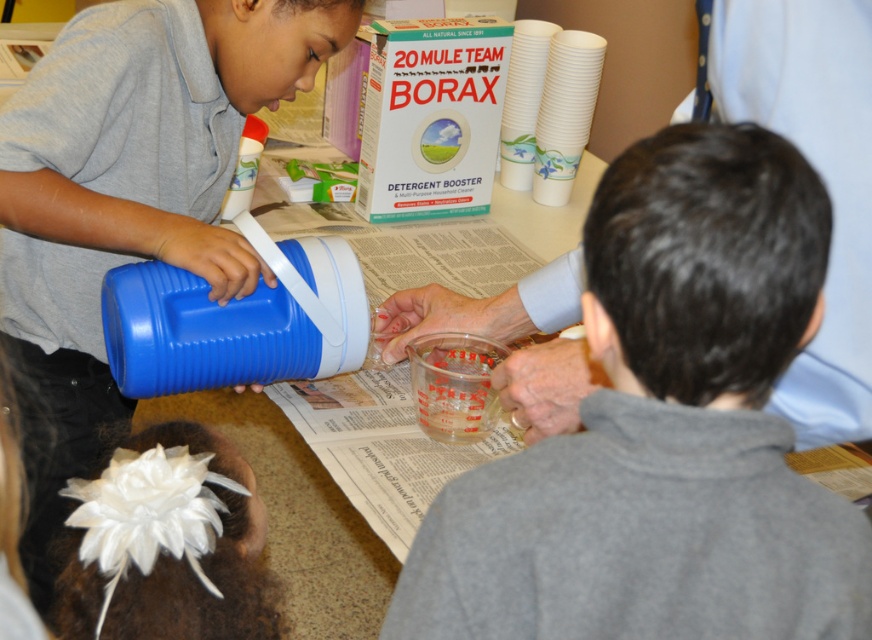
Question: Does gray fleece sweatshirt at center come behind matte blue thermos at left?

Choices:
 (A) yes
 (B) no

Answer: (B)

Question: Which object is farther from the camera taking this photo?

Choices:
 (A) matte blue thermos at left
 (B) gray fleece sweatshirt at center

Answer: (A)

Question: Observing the image, what is the correct spatial positioning of gray fleece sweatshirt at center in reference to matte blue thermos at left?

Choices:
 (A) below
 (B) above

Answer: (A)

Question: Does gray fleece sweatshirt at center appear on the left side of matte blue thermos at left?

Choices:
 (A) yes
 (B) no

Answer: (B)

Question: Which object is farther from the camera taking this photo?

Choices:
 (A) matte blue thermos at left
 (B) gray fleece sweatshirt at center

Answer: (A)